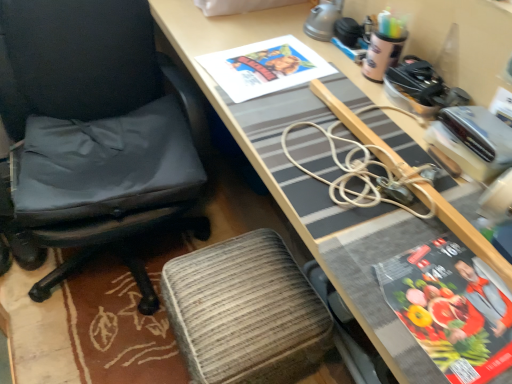
Question: Is textured fabric stool at lower center oriented towards matte paper book cover at upper center?

Choices:
 (A) no
 (B) yes

Answer: (A)

Question: Can you confirm if textured fabric stool at lower center is shorter than matte paper book cover at upper center?

Choices:
 (A) no
 (B) yes

Answer: (A)

Question: Is textured fabric stool at lower center touching matte paper book cover at upper center?

Choices:
 (A) yes
 (B) no

Answer: (B)

Question: Is textured fabric stool at lower center positioned behind matte paper book cover at upper center?

Choices:
 (A) yes
 (B) no

Answer: (B)

Question: Is textured fabric stool at lower center facing away from matte paper book cover at upper center?

Choices:
 (A) no
 (B) yes

Answer: (A)

Question: Is black fabric chair at left inside the boundaries of textured fabric stool at lower center, or outside?

Choices:
 (A) outside
 (B) inside

Answer: (A)

Question: Is point (33, 168) positioned closer to the camera than point (221, 284)?

Choices:
 (A) closer
 (B) farther

Answer: (B)

Question: From a real-world perspective, is black fabric chair at left above or below textured fabric stool at lower center?

Choices:
 (A) below
 (B) above

Answer: (B)

Question: In terms of size, does black fabric chair at left appear bigger or smaller than textured fabric stool at lower center?

Choices:
 (A) small
 (B) big

Answer: (B)

Question: Choose the correct answer: Is textured fabric stool at lower center inside black fabric chair at left or outside it?

Choices:
 (A) inside
 (B) outside

Answer: (B)

Question: Considering the positions of textured fabric stool at lower center and black fabric chair at left in the image, is textured fabric stool at lower center wider or thinner than black fabric chair at left?

Choices:
 (A) thin
 (B) wide

Answer: (A)

Question: Based on their positions, is textured fabric stool at lower center located to the left or right of black fabric chair at left?

Choices:
 (A) left
 (B) right

Answer: (B)

Question: From the image's perspective, is textured fabric stool at lower center above or below black fabric chair at left?

Choices:
 (A) above
 (B) below

Answer: (B)

Question: Would you say textured fabric stool at lower center is to the left or to the right of wooden desk at center in the picture?

Choices:
 (A) right
 (B) left

Answer: (B)

Question: In terms of width, does textured fabric stool at lower center look wider or thinner when compared to wooden desk at center?

Choices:
 (A) thin
 (B) wide

Answer: (A)